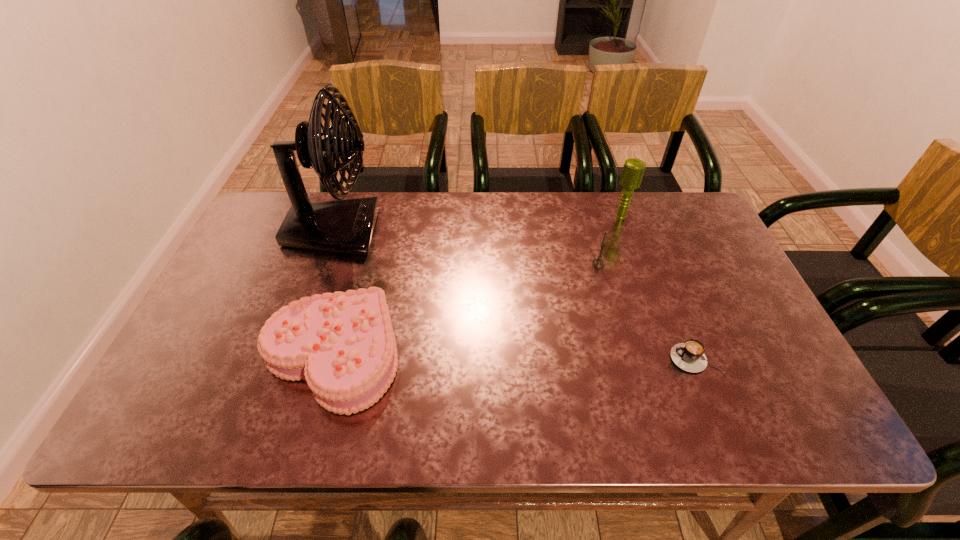
Where is `vacant space at the near edge of the desktop`? vacant space at the near edge of the desktop is located at coordinates (462, 431).

You are a GUI agent. You are given a task and a screenshot of the screen. Output one action in this format:
    pyautogui.click(x=<x>, y=<y>)
    Task: Click on the blank space at the left edge of the desktop
    
    Given the screenshot: What is the action you would take?
    pyautogui.click(x=208, y=375)

In the image, there is a desktop. Find the location of `vacant space at the right edge`. vacant space at the right edge is located at coordinates 675,252.

Find the location of a particular element. free area in between the fourth shortest object and the third shortest object is located at coordinates [610, 240].

Find the location of a particular element. The image size is (960, 540). free space between the fourth tallest object and the microphone is located at coordinates (477, 286).

In order to click on empty space between the fourth tallest object and the microphone in this screenshot , I will do `click(477, 286)`.

You are a GUI agent. You are given a task and a screenshot of the screen. Output one action in this format:
    pyautogui.click(x=<x>, y=<y>)
    Task: Click on the empty location between the second shortest object and the microphone
    Image resolution: width=960 pixels, height=540 pixels.
    Given the screenshot: What is the action you would take?
    pyautogui.click(x=477, y=286)

Find the location of a particular element. This screenshot has width=960, height=540. vacant area between the third object from right to left and the tallest object is located at coordinates (467, 247).

Find the location of a particular element. The image size is (960, 540). free space between the fourth shortest object and the fan is located at coordinates (477, 224).

The height and width of the screenshot is (540, 960). I want to click on free spot between the second shortest object and the cappuccino, so tap(514, 356).